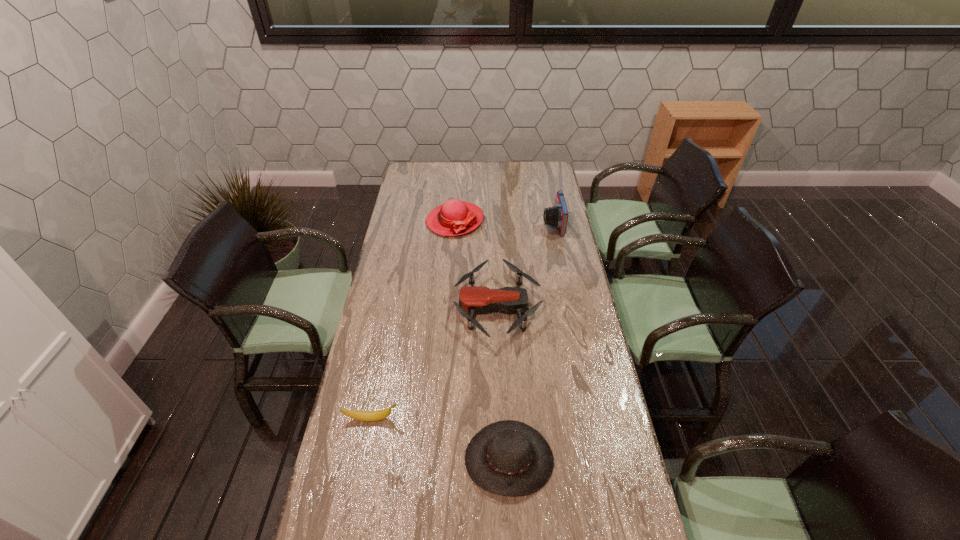
Locate an element on the screen. The image size is (960, 540). camera is located at coordinates (557, 216).

Where is `the fourth shortest object`? the fourth shortest object is located at coordinates coord(454,217).

Locate an element on the screen. Image resolution: width=960 pixels, height=540 pixels. the taller hat is located at coordinates (454, 217).

Where is `the shorter hat`? the shorter hat is located at coordinates (509, 458).

Identify the location of the nearer hat. The height and width of the screenshot is (540, 960). pyautogui.click(x=509, y=458).

The height and width of the screenshot is (540, 960). Identify the location of drone. (473, 300).

This screenshot has width=960, height=540. Identify the location of the second nearest object. (378, 415).

Where is `vacant space located 0.350m on the front-facing side of the camera`? The width and height of the screenshot is (960, 540). vacant space located 0.350m on the front-facing side of the camera is located at coordinates click(x=469, y=224).

This screenshot has height=540, width=960. What are the coordinates of `blank space located 0.270m on the front-facing side of the camera` in the screenshot? It's located at coord(487,224).

I want to click on vacant space situated on the front-facing side of the camera, so click(464, 224).